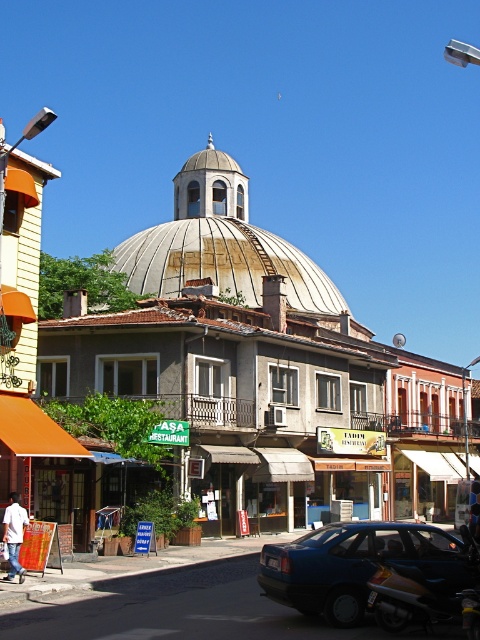
Can you confirm if white textured dome at center is smaller than blue matte sedan at lower right?

Incorrect, white textured dome at center is not smaller in size than blue matte sedan at lower right.

Is point (317, 442) in front of point (470, 570)?

No.

Is point (322, 508) less distant than point (335, 586)?

No, it is not.

Find the location of a particular element. white textured dome at center is located at coordinates (262, 369).

Is white textured dome at center to the left of shiny chrome motorcycle at lower right from the viewer's perspective?

Indeed, white textured dome at center is positioned on the left side of shiny chrome motorcycle at lower right.

Is white textured dome at center further to the viewer compared to shiny chrome motorcycle at lower right?

Yes, it is behind shiny chrome motorcycle at lower right.

Identify the location of white textured dome at center. The height and width of the screenshot is (640, 480). tap(262, 369).

Image resolution: width=480 pixels, height=640 pixels. I want to click on white textured dome at center, so click(262, 369).

Which of these two, white textured dome at center or rusty metal dome at center, stands shorter?

white textured dome at center is shorter.

Does white textured dome at center appear under rusty metal dome at center?

Yes.

Who is more forward, (252, 419) or (211, 202)?

Point (252, 419) is more forward.

The width and height of the screenshot is (480, 640). Identify the location of white textured dome at center. (262, 369).